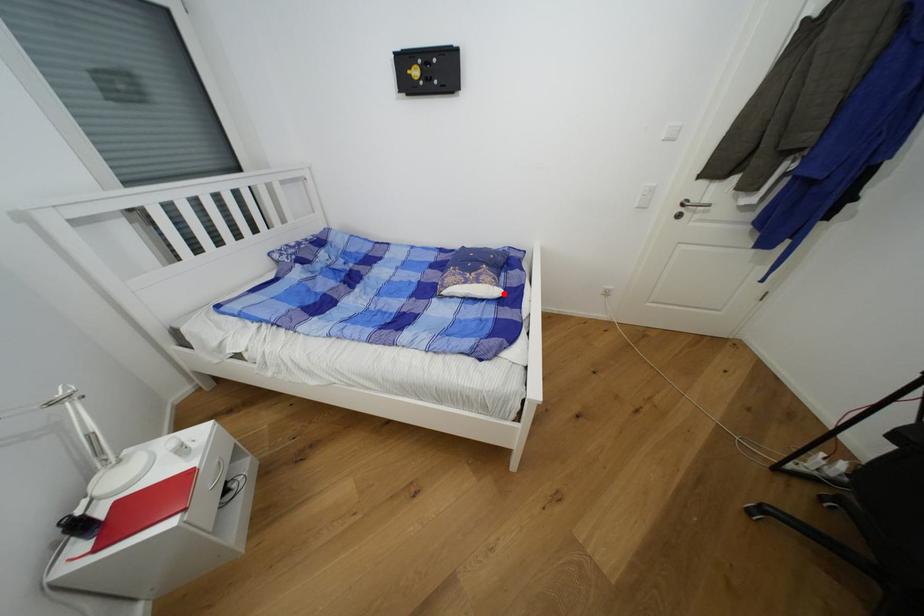
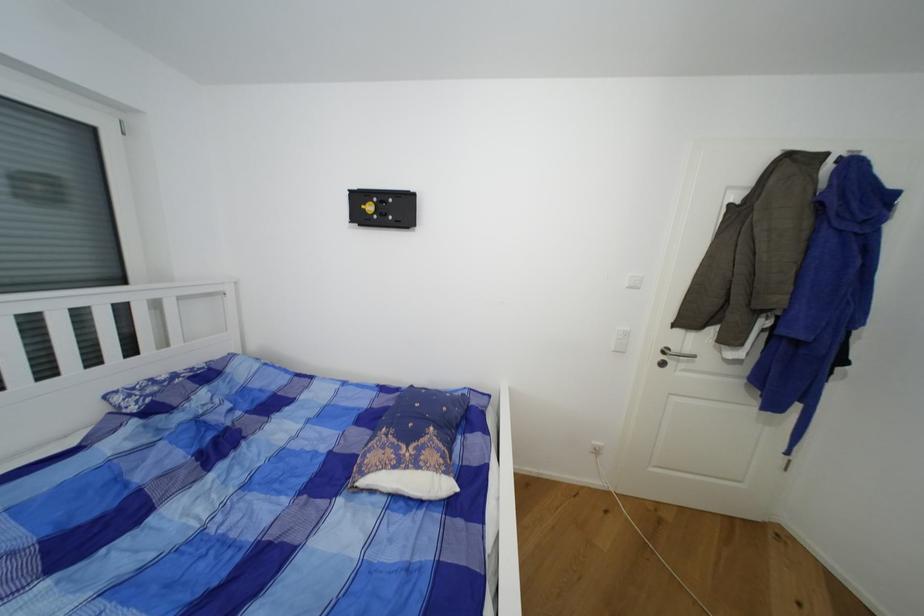
The point at the highlighted location is marked in the first image. Where is the corresponding point in the second image?

(454, 488)